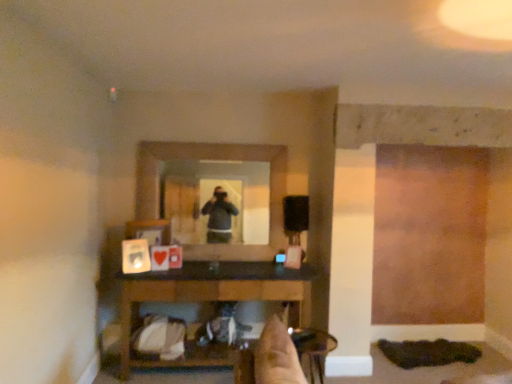
Question: Can you confirm if wooden table at lower center is smaller than clear glass mirror at center?

Choices:
 (A) yes
 (B) no

Answer: (B)

Question: Considering the relative positions of wooden table at lower center and clear glass mirror at center in the image provided, is wooden table at lower center to the right of clear glass mirror at center from the viewer's perspective?

Choices:
 (A) no
 (B) yes

Answer: (B)

Question: Does wooden table at lower center turn towards clear glass mirror at center?

Choices:
 (A) no
 (B) yes

Answer: (A)

Question: Considering the relative positions of wooden table at lower center and clear glass mirror at center in the image provided, is wooden table at lower center to the left of clear glass mirror at center from the viewer's perspective?

Choices:
 (A) yes
 (B) no

Answer: (B)

Question: Can you confirm if wooden table at lower center is taller than clear glass mirror at center?

Choices:
 (A) no
 (B) yes

Answer: (A)

Question: From the image's perspective, is wooden table at lower center located beneath clear glass mirror at center?

Choices:
 (A) yes
 (B) no

Answer: (A)

Question: Can you see clear glass mirror at center touching metallic silver chair at lower center?

Choices:
 (A) yes
 (B) no

Answer: (B)

Question: Is the position of clear glass mirror at center more distant than that of metallic silver chair at lower center?

Choices:
 (A) yes
 (B) no

Answer: (A)

Question: Considering the relative sizes of clear glass mirror at center and metallic silver chair at lower center in the image provided, is clear glass mirror at center smaller than metallic silver chair at lower center?

Choices:
 (A) yes
 (B) no

Answer: (B)

Question: From a real-world perspective, is clear glass mirror at center located higher than metallic silver chair at lower center?

Choices:
 (A) no
 (B) yes

Answer: (B)

Question: Does clear glass mirror at center have a lesser width compared to metallic silver chair at lower center?

Choices:
 (A) no
 (B) yes

Answer: (B)

Question: Is clear glass mirror at center not within metallic silver chair at lower center?

Choices:
 (A) yes
 (B) no

Answer: (A)

Question: From a real-world perspective, is metallic silver chair at lower center on top of clear glass mirror at center?

Choices:
 (A) no
 (B) yes

Answer: (A)